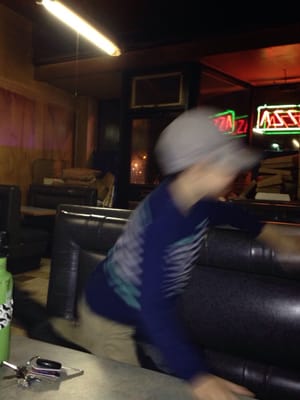
At what (x,y) coordinates should I click in order to perform the action: click on wall. Please return your answer as a coordinate pair (x, y). The height and width of the screenshot is (400, 300). Looking at the image, I should click on (39, 132).